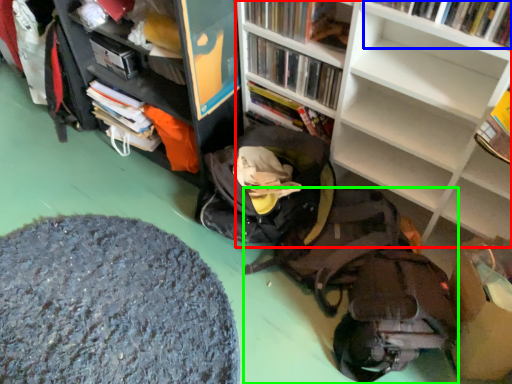
Question: Which is farther away from bookcase (highlighted by a red box)? book (highlighted by a blue box) or backpack (highlighted by a green box)?

Choices:
 (A) book
 (B) backpack

Answer: (B)